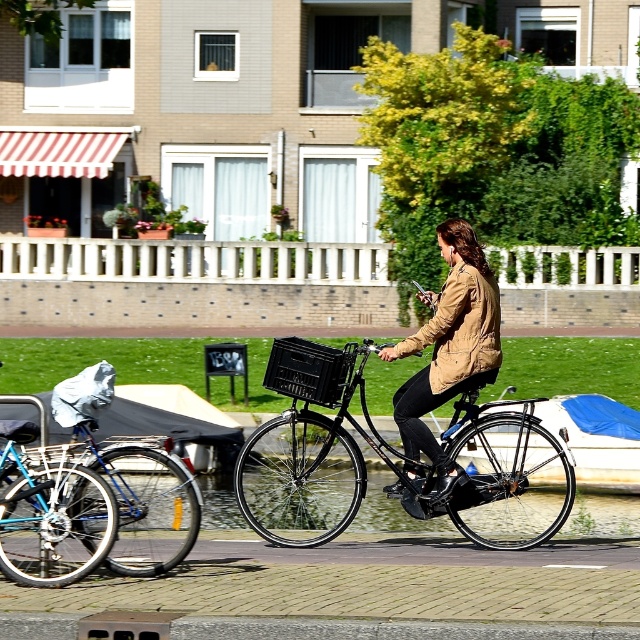
Question: Which object appears closest to the camera in this image?

Choices:
 (A) blue tarpaulin boat at center
 (B) black matte bicycle at center
 (C) camouflage jacket at center

Answer: (B)

Question: Is black matte bicycle at center to the right of blue tarpaulin boat at center from the viewer's perspective?

Choices:
 (A) no
 (B) yes

Answer: (A)

Question: Estimate the real-world distances between objects in this image. Which object is farther from the camouflage jacket at center?

Choices:
 (A) black matte bicycle at center
 (B) blue metallic bicycle at center
 (C) blue tarpaulin boat at center

Answer: (B)

Question: Does blue metallic bicycle at center appear under blue tarpaulin boat at center?

Choices:
 (A) yes
 (B) no

Answer: (A)

Question: From the image, what is the correct spatial relationship of camouflage jacket at center in relation to blue tarpaulin boat at center?

Choices:
 (A) right
 (B) left

Answer: (B)

Question: Among these objects, which one is nearest to the camera?

Choices:
 (A) black matte bicycle at center
 (B) camouflage jacket at center

Answer: (A)